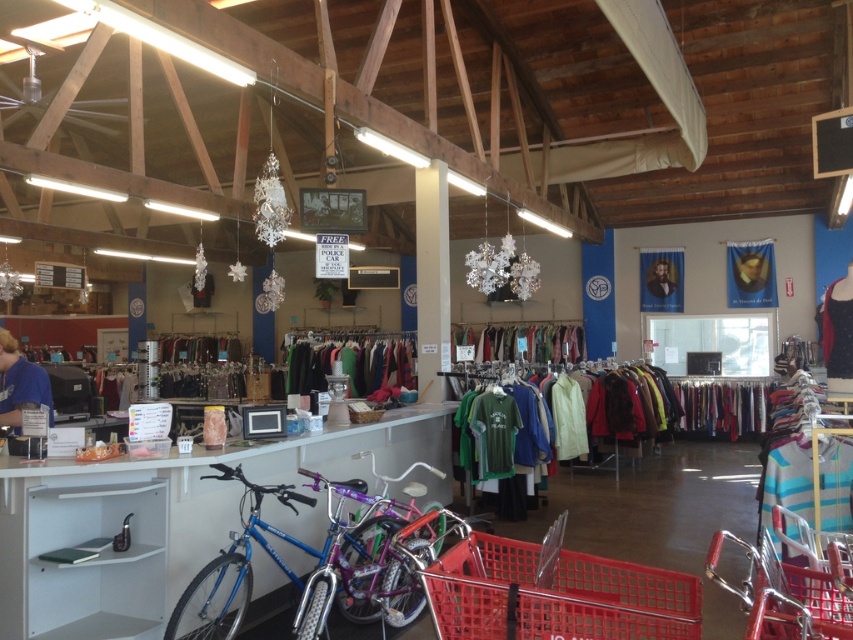
Is green fabric dress at center to the left of blue shirt at left from the viewer's perspective?

In fact, green fabric dress at center is to the right of blue shirt at left.

This screenshot has width=853, height=640. What are the coordinates of `green fabric dress at center` in the screenshot? It's located at (352, 364).

Which is in front, point (370, 356) or point (0, 365)?

Point (0, 365) is more forward.

Where is `green fabric dress at center`? green fabric dress at center is located at coordinates (352, 364).

Can you confirm if white matte shelf at lower left is positioned below green fabric dress at center?

Indeed, white matte shelf at lower left is positioned under green fabric dress at center.

Identify the location of white matte shelf at lower left. The height and width of the screenshot is (640, 853). (96, 561).

Is point (242, 477) closer to camera compared to point (10, 340)?

Yes, point (242, 477) is in front of point (10, 340).

Who is higher up, shiny blue bicycle at center or blue shirt at left?

blue shirt at left is higher up.

Locate an element on the screen. shiny blue bicycle at center is located at coordinates (276, 550).

Where is `shiny blue bicycle at center`? The height and width of the screenshot is (640, 853). shiny blue bicycle at center is located at coordinates (276, 550).